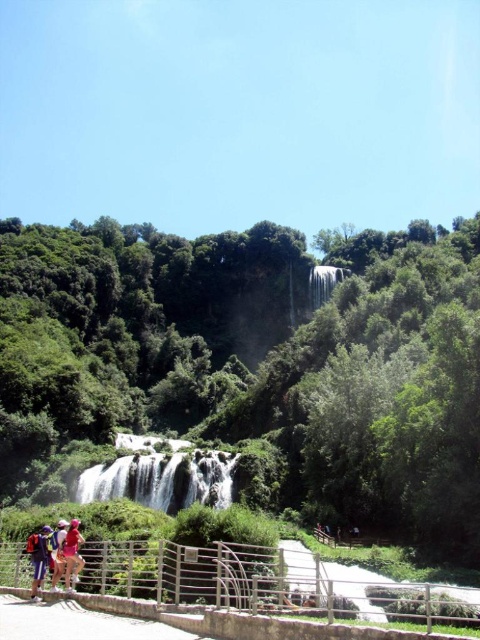
Is white frothy water at center below matte pink shirt at lower left?

Yes.

Can you confirm if white frothy water at center is wider than matte pink shirt at lower left?

Indeed, white frothy water at center has a greater width compared to matte pink shirt at lower left.

You are a GUI agent. You are given a task and a screenshot of the screen. Output one action in this format:
    pyautogui.click(x=<x>, y=<y>)
    Task: Click on the white frothy water at center
    The height and width of the screenshot is (640, 480).
    Given the screenshot: What is the action you would take?
    pyautogui.click(x=162, y=480)

I want to click on white frothy water at center, so click(162, 480).

Does silver metallic rail at lower center appear on the right side of white frothy water at center?

Yes, silver metallic rail at lower center is to the right of white frothy water at center.

Does silver metallic rail at lower center appear over white frothy water at center?

Yes.

Is point (376, 612) in front of point (96, 477)?

Yes, it is in front of point (96, 477).

Find the location of a particular element. This screenshot has width=480, height=640. silver metallic rail at lower center is located at coordinates click(265, 582).

Is matte purple shorts at lower left taller than matte pink backpack at lower left?

Indeed, matte purple shorts at lower left has a greater height compared to matte pink backpack at lower left.

Who is more distant from viewer, (48,541) or (62,561)?

The point (48,541) is more distant.

Between point (48, 548) and point (55, 566), which one is positioned in front?

Point (55, 566) is in front.

Identify the location of matte purple shorts at lower left. Image resolution: width=480 pixels, height=640 pixels. (38, 557).